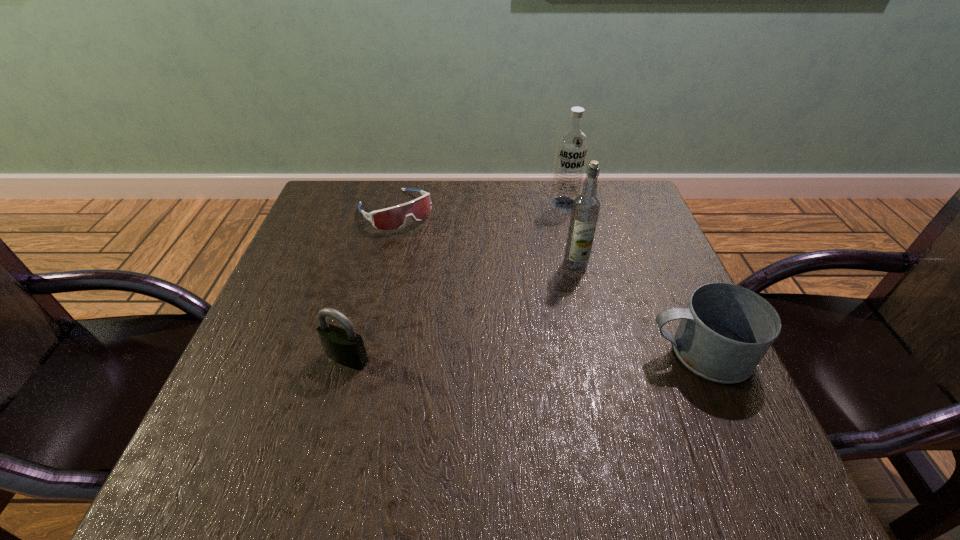
Find the location of a particular element. The height and width of the screenshot is (540, 960). free space between the mug and the shortest object is located at coordinates (547, 281).

Find the location of a particular element. The height and width of the screenshot is (540, 960). free spot between the shortest object and the farther vodka is located at coordinates (479, 207).

Find the location of a particular element. vacant space in between the shortest object and the third farthest object is located at coordinates (485, 238).

The height and width of the screenshot is (540, 960). I want to click on blank region between the third nearest object and the rightmost object, so click(637, 308).

Identify the location of object that is the closest to the third nearest object. (725, 330).

Identify which object is the nearest to the farther vodka. Please provide its 2D coordinates. Your answer should be formatted as a tuple, i.e. [(x, y)], where the tuple contains the x and y coordinates of a point satisfying the conditions above.

[(586, 207)]

Identify the location of vacant space that satisfies the following two spatial constraints: 1. on the back side of the farther vodka; 2. on the left side of the goggles. The width and height of the screenshot is (960, 540). (396, 204).

You are a GUI agent. You are given a task and a screenshot of the screen. Output one action in this format:
    pyautogui.click(x=<x>, y=<y>)
    Task: Click on the free region that satisfies the following two spatial constraints: 1. on the front side of the rightmost object; 2. on the side of the shortest object with the handle
    Image resolution: width=960 pixels, height=540 pixels.
    Given the screenshot: What is the action you would take?
    pyautogui.click(x=360, y=352)

Locate an element on the screen. The image size is (960, 540). vacant area in the image that satisfies the following two spatial constraints: 1. on the back side of the mug; 2. on the side of the padlock with the handle is located at coordinates (348, 352).

The image size is (960, 540). What are the coordinates of `free space that satisfies the following two spatial constraints: 1. on the front side of the third farthest object; 2. on the side of the rightmost object with the handle` in the screenshot? It's located at point(596,352).